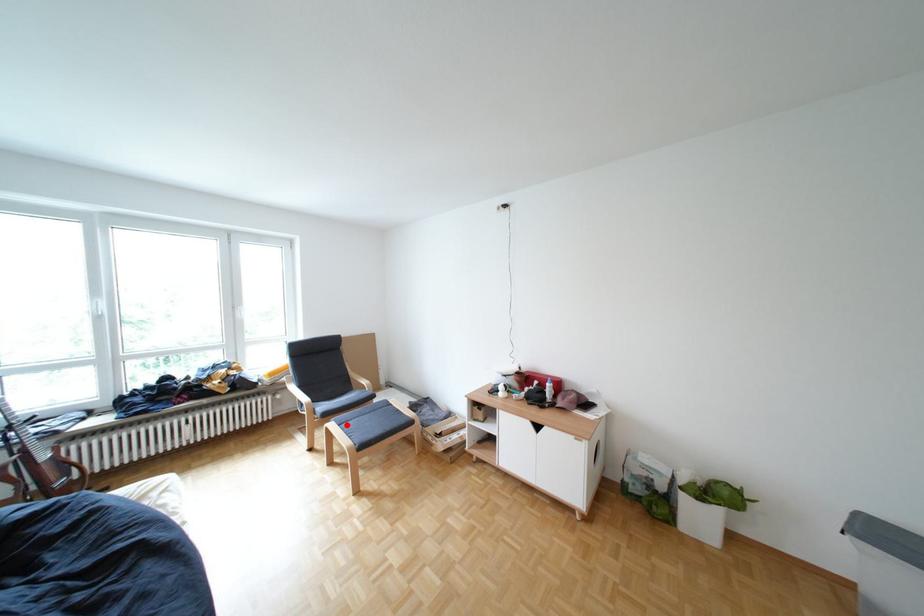
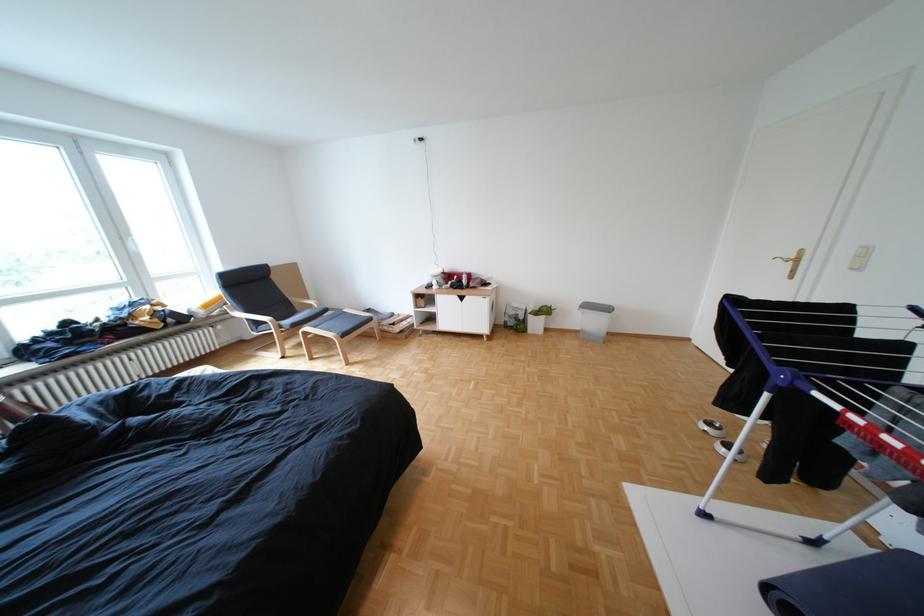
Locate, in the second image, the point that corresponds to the highlighted location in the first image.

(322, 329)